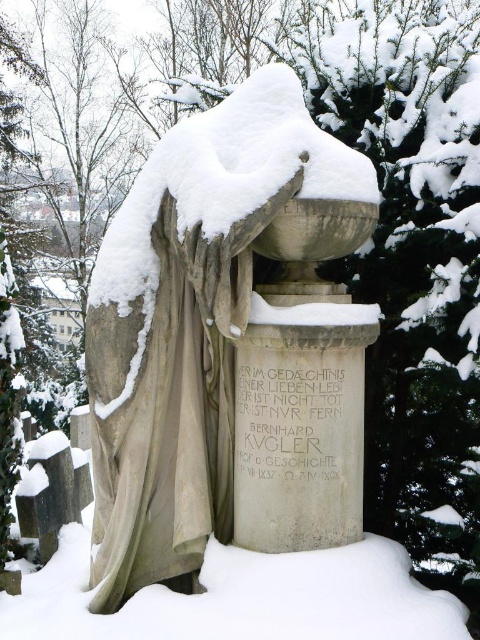
You are standing in front of the tombstone scene. You see the stone statue at center and the white stone inscription at center. Which object is closer to you?

The stone statue at center is closer to you than the white stone inscription at center.

You are standing in the winter scene and want to read the inscription on the white stone inscription at center. Which direction should you move relative to the stone statue at center to reach it?

The white stone inscription at center is to the right of the stone statue at center, so you should move to the right relative to the stone statue at center to reach it.

Based on the scene description, can you determine the spatial relationship between the stone statue at center and the white stone inscription at center?

The stone statue at center is above the white stone inscription at center.